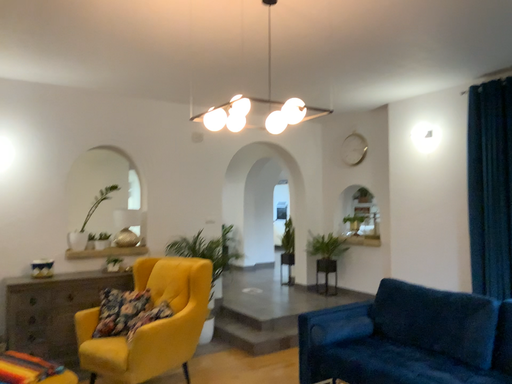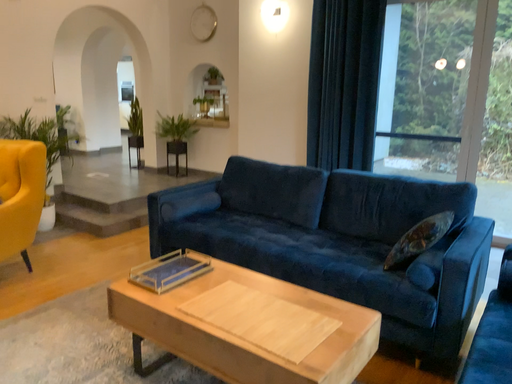
Question: How did the camera likely rotate when shooting the video?

Choices:
 (A) rotated downward
 (B) rotated upward

Answer: (A)